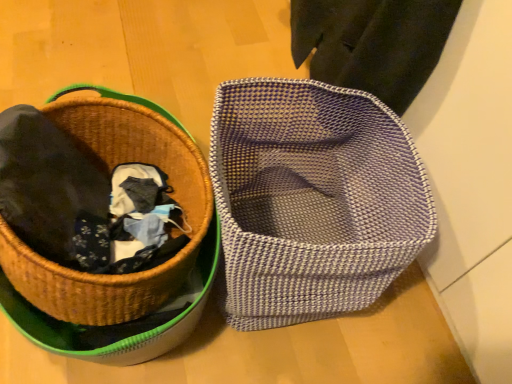
Question: Is textured woven basket at center wider or thinner than woven brown picnic basket at left?

Choices:
 (A) wide
 (B) thin

Answer: (B)

Question: In the image, is textured woven basket at center on the left side or the right side of woven brown picnic basket at left?

Choices:
 (A) left
 (B) right

Answer: (B)

Question: Is textured woven basket at center inside the boundaries of woven brown picnic basket at left, or outside?

Choices:
 (A) outside
 (B) inside

Answer: (A)

Question: From the image's perspective, is woven brown picnic basket at left positioned above or below textured woven basket at center?

Choices:
 (A) above
 (B) below

Answer: (A)

Question: From a real-world perspective, is woven brown picnic basket at left above or below textured woven basket at center?

Choices:
 (A) below
 (B) above

Answer: (B)

Question: In the image, is woven brown picnic basket at left positioned in front of or behind textured woven basket at center?

Choices:
 (A) behind
 (B) front

Answer: (B)

Question: In terms of width, does woven brown picnic basket at left look wider or thinner when compared to textured woven basket at center?

Choices:
 (A) thin
 (B) wide

Answer: (B)